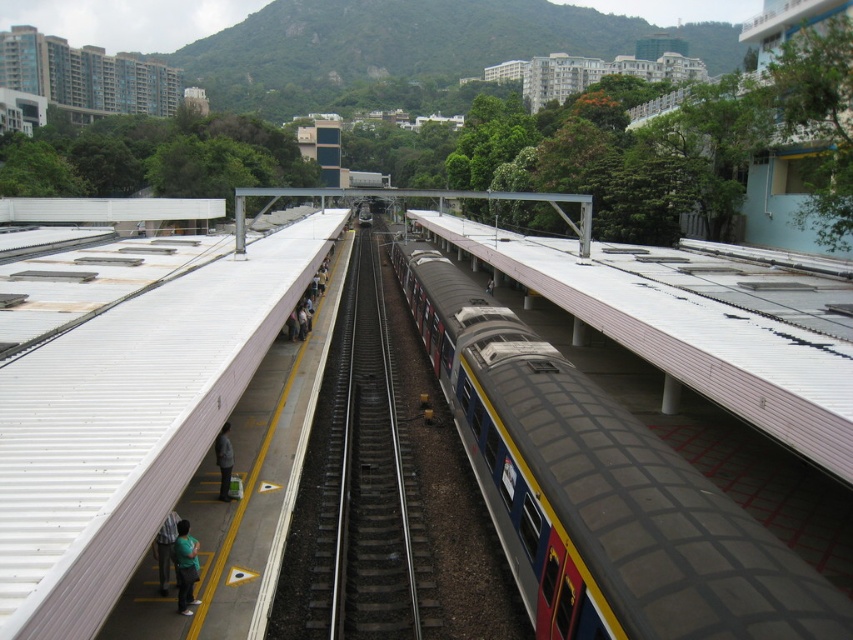
You are a passenger at the train station and want to walk from point (460, 390) to point (383, 483). Which direction should you move in relation to the train?

You should move towards the train because point (460, 390) is further away from the camera than point (383, 483), so moving toward the train would bring you closer to the destination point.

You are standing at the point labeled as point (599, 492) in the image. What object is located exactly at this point?

The point (599, 492) corresponds to the metallic gray train at center.

You are a passenger standing at the edge of the left platform in the train station. You notice two points marked on the ground ahead of you. The first point is at coordinate point (363, 632) and the second is at point (228, 451). Which point is closer to your current position?

Point (363, 632) is closer to the camera than point (228, 451), so the first point is closer to your current position.